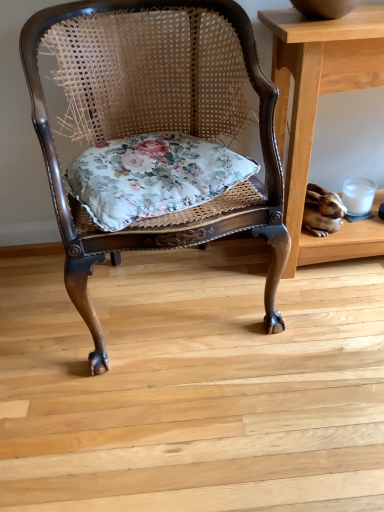
This screenshot has height=512, width=384. Find the location of `vacant space to the left of rattan chair with floral cushion at center`. vacant space to the left of rattan chair with floral cushion at center is located at coordinates (36, 307).